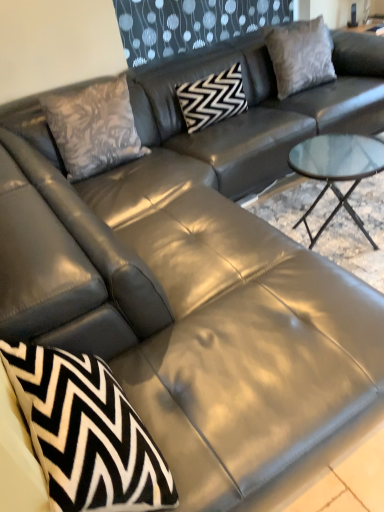
Question: In the image, is black zigzag-patterned pillow at center, which ranks as the 2th pillow in right-to-left order, on the left side or the right side of floral-patterned fabric pillow at upper left, which is the second throw pillow from front to back?

Choices:
 (A) right
 (B) left

Answer: (A)

Question: Is black zigzag-patterned pillow at center, which ranks as the 2th pillow in right-to-left order, in front of or behind floral-patterned fabric pillow at upper left, which ranks as the 1th throw pillow in top-to-bottom order, in the image?

Choices:
 (A) behind
 (B) front

Answer: (A)

Question: Estimate the real-world distances between objects in this image. Which object is farther from the black and white zigzag pillow at lower left, which is the first throw pillow in bottom-to-top order?

Choices:
 (A) black zigzag-patterned pillow at center, which ranks as the 2th pillow in right-to-left order
 (B) suede gray pillow at upper right, the 1th pillow in the right-to-left sequence
 (C) floral-patterned fabric pillow at upper left, which is the second throw pillow from front to back

Answer: (B)

Question: Which object is positioned closest to the suede gray pillow at upper right, the 1th pillow in the right-to-left sequence?

Choices:
 (A) black and white zigzag pillow at lower left, which ranks as the first throw pillow in front-to-back order
 (B) black zigzag-patterned pillow at center, arranged as the 1th pillow when viewed from the left
 (C) floral-patterned fabric pillow at upper left, the first throw pillow viewed from the back

Answer: (B)